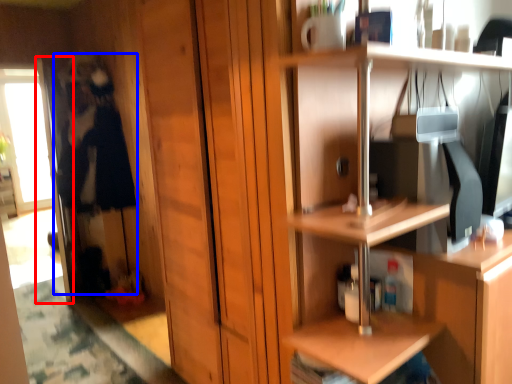
Question: Which of the following is the farthest to the observer, screen door (highlighted by a red box) or person (highlighted by a blue box)?

Choices:
 (A) screen door
 (B) person

Answer: (A)